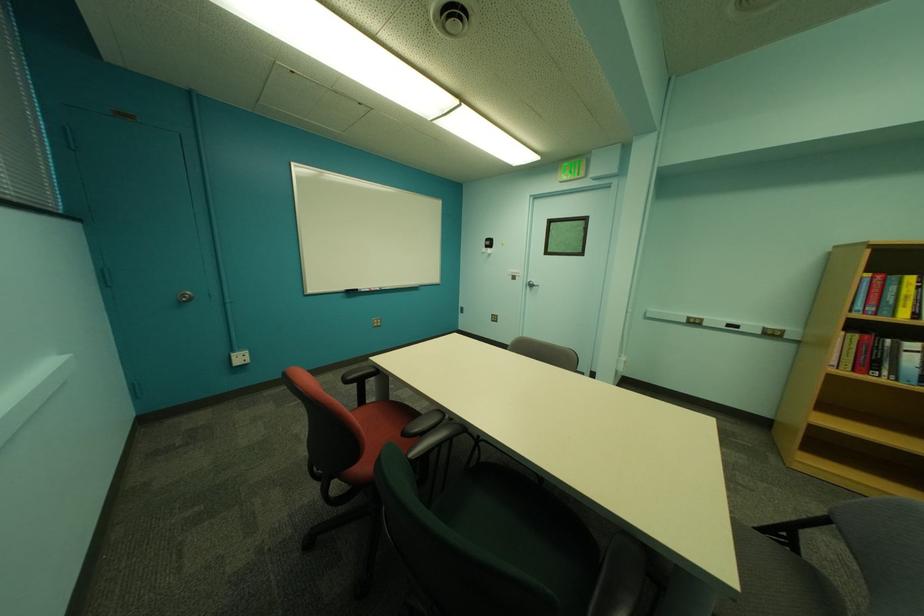
You are a GUI agent. You are given a task and a screenshot of the screen. Output one action in this format:
    pyautogui.click(x=<x>, y=<y>)
    Task: Click on the red chair sitting surface
    This screenshot has height=616, width=924.
    Given the screenshot: What is the action you would take?
    pyautogui.click(x=383, y=416)